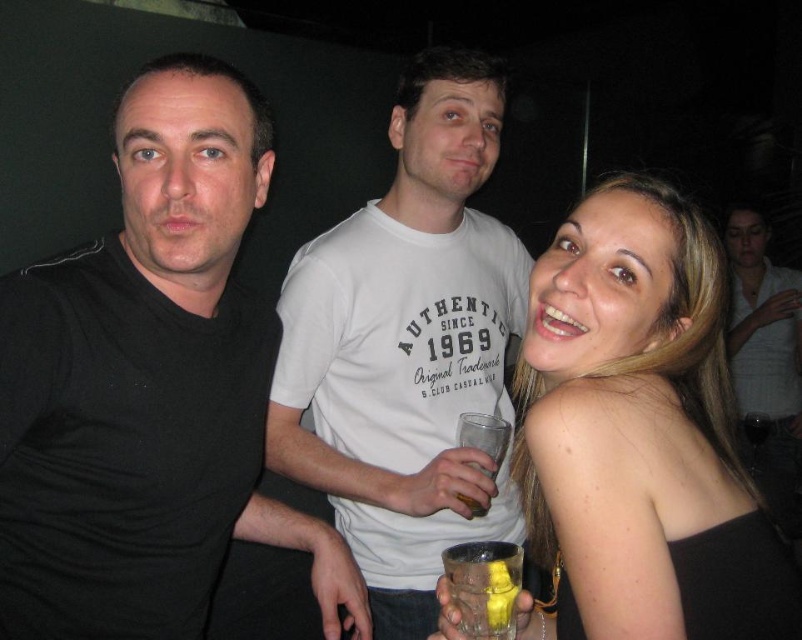
Is black matte shirt at left below translucent glass at center?

Incorrect, black matte shirt at left is not positioned below translucent glass at center.

Is point (1, 584) less distant than point (476, 509)?

Yes, point (1, 584) is closer to viewer.

Is point (0, 323) less distant than point (472, 465)?

Yes, point (0, 323) is in front of point (472, 465).

This screenshot has width=802, height=640. What are the coordinates of `black matte shirt at left` in the screenshot? It's located at (148, 388).

Between black matte shirt at left and white cotton t-shirt at center, which one appears on the left side from the viewer's perspective?

Positioned to the left is black matte shirt at left.

Is point (185, 520) more distant than point (410, 81)?

No, (185, 520) is closer to viewer.

The height and width of the screenshot is (640, 802). I want to click on black matte shirt at left, so click(x=148, y=388).

Which is in front, point (740, 266) or point (508, 586)?

Point (508, 586) is more forward.

Based on the photo, is white cotton shirt at upper right shorter than translucent glass at lower right?

Incorrect, white cotton shirt at upper right's height does not fall short of translucent glass at lower right's.

Describe the element at coordinates (764, 356) in the screenshot. I see `white cotton shirt at upper right` at that location.

I want to click on white cotton shirt at upper right, so click(x=764, y=356).